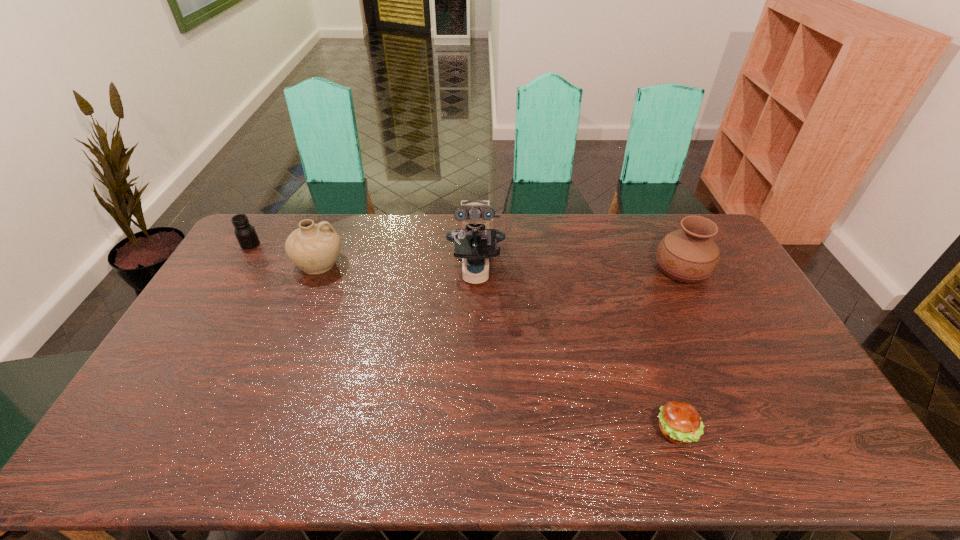
At what (x,y) coordinates should I click in order to perform the action: click on object that is positioned at the far left corner. Please return your answer as a coordinate pair (x, y). The image size is (960, 540). Looking at the image, I should click on (245, 233).

Where is `object that is at the far right corner`? This screenshot has height=540, width=960. object that is at the far right corner is located at coordinates (689, 255).

Where is `free region at the far edge of the desktop`? free region at the far edge of the desktop is located at coordinates (358, 248).

Identify the location of free location at the near edge of the desktop. The height and width of the screenshot is (540, 960). (320, 454).

This screenshot has width=960, height=540. Identify the location of blank area at the left edge. [x=154, y=409].

The height and width of the screenshot is (540, 960). Find the location of `free space at the right edge`. free space at the right edge is located at coordinates (735, 298).

Identify the location of vacant space at the far left corner. This screenshot has height=540, width=960. (275, 214).

You are a GUI agent. You are given a task and a screenshot of the screen. Output one action in this format:
    pyautogui.click(x=<x>, y=<y>)
    Task: Click on the free space between the nearest object and the urn
    The width and height of the screenshot is (960, 540).
    Given the screenshot: What is the action you would take?
    pyautogui.click(x=679, y=349)

This screenshot has width=960, height=540. In order to click on free space between the third object from right to left and the second shortest object in this screenshot , I will do pos(363,258).

Find the location of a particular element. free space between the pottery and the tallest object is located at coordinates (397, 267).